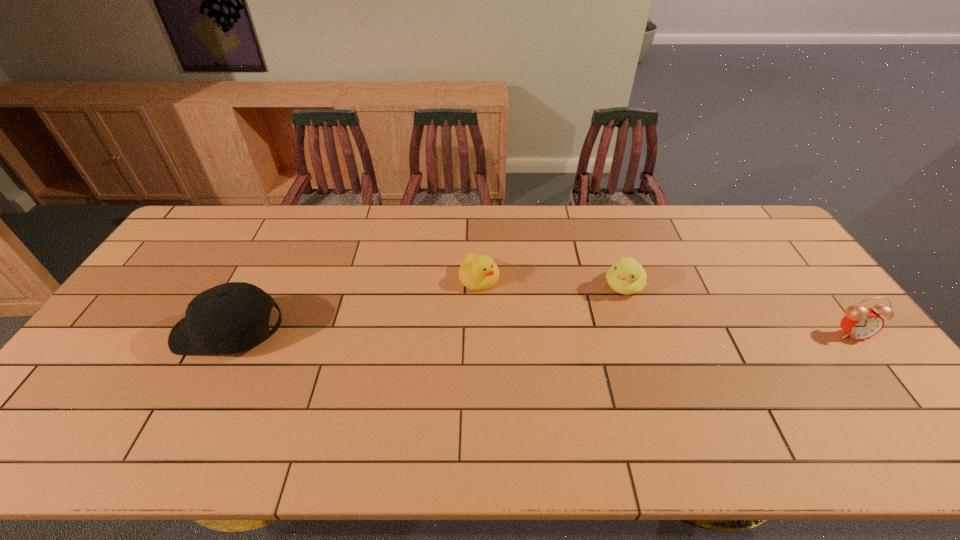
This screenshot has width=960, height=540. I want to click on free space located 0.340m at the beak of the second object from right to left, so click(x=556, y=374).

The image size is (960, 540). Identify the location of vacant space positioned at the beak of the second object from right to left. (577, 346).

At what (x,y) coordinates should I click in order to perform the action: click on free space located on the face of the left duckling. Please return your answer as a coordinate pair (x, y). This screenshot has width=960, height=540. Looking at the image, I should click on (542, 346).

Where is `vacant area situated on the face of the left duckling`? vacant area situated on the face of the left duckling is located at coordinates (538, 341).

Identify the location of free region located on the face of the left duckling. This screenshot has width=960, height=540. (506, 306).

This screenshot has height=540, width=960. Find the location of `object present at the right edge`. object present at the right edge is located at coordinates (859, 323).

The height and width of the screenshot is (540, 960). In the image, there is a desktop. Find the location of `vacant space at the far edge`. vacant space at the far edge is located at coordinates (395, 208).

In the image, there is a desktop. Where is `vacant space at the near edge`? Image resolution: width=960 pixels, height=540 pixels. vacant space at the near edge is located at coordinates (155, 393).

Find the location of a particular element. This screenshot has height=540, width=960. vacant area at the far left corner is located at coordinates [221, 210].

In the image, there is a desktop. At what (x,y) coordinates should I click in order to perform the action: click on free space at the near right corner. Please return your answer as a coordinate pair (x, y). The image size is (960, 540). Looking at the image, I should click on (904, 414).